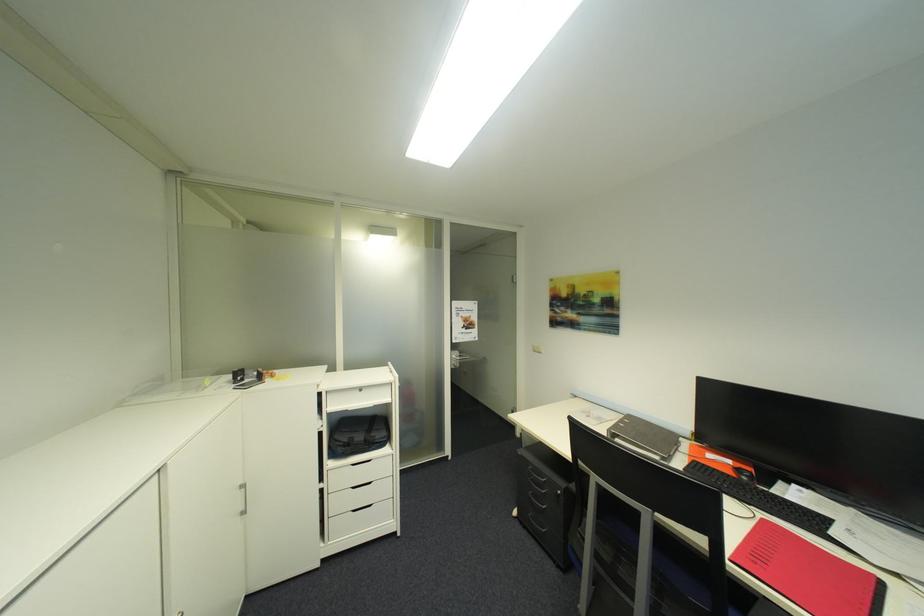
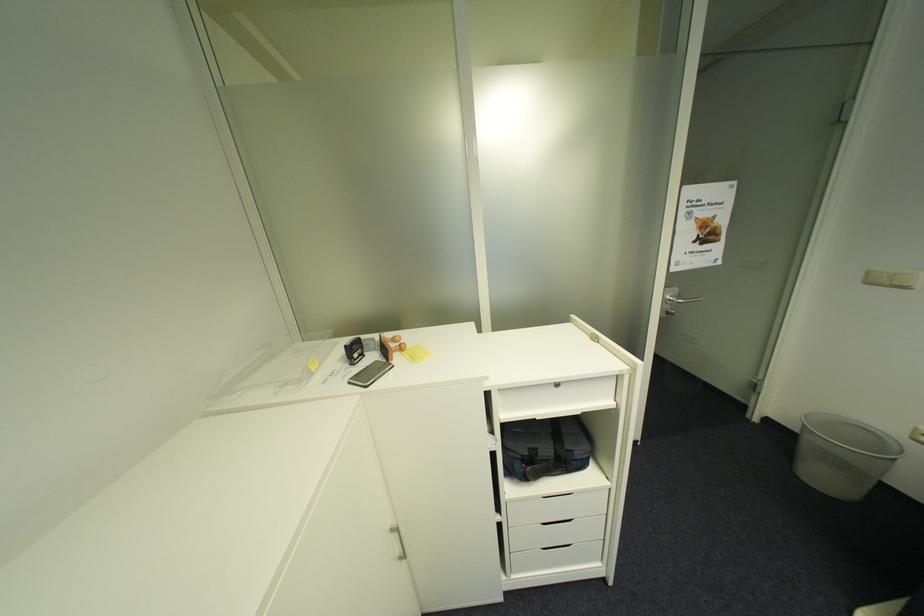
What movement of the cameraman would produce the second image?

The movement direction of the cameraman is left, forward.